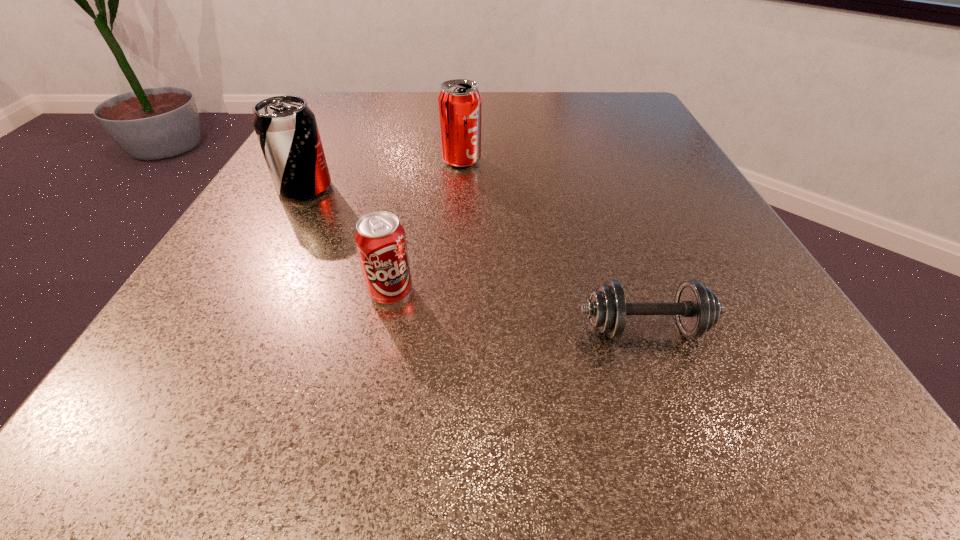
This screenshot has height=540, width=960. In the image, there is a desktop. Identify the location of vacant space at the far right corner. (586, 134).

Locate an element on the screen. empty space between the second farthest object and the rightmost object is located at coordinates (475, 258).

Identify the location of free spot between the third object from left to right and the third nearest object. (383, 174).

The width and height of the screenshot is (960, 540). In order to click on empty space that is in between the leftmost object and the second soda from left to right in this screenshot , I will do `click(348, 240)`.

This screenshot has width=960, height=540. I want to click on free space between the shortest soda and the second nearest soda, so click(x=348, y=240).

You are a GUI agent. You are given a task and a screenshot of the screen. Output one action in this format:
    pyautogui.click(x=<x>, y=<y>)
    Task: Click on the unoccupied position between the leftmost object and the farthest object
    
    Given the screenshot: What is the action you would take?
    pyautogui.click(x=383, y=174)

Where is `free spot between the shortest object and the nearest soda`? The image size is (960, 540). free spot between the shortest object and the nearest soda is located at coordinates (517, 310).

Identify the location of vacant space that is in between the nearest soda and the third nearest object. (348, 240).

This screenshot has height=540, width=960. What are the coordinates of `free spot between the shortest object and the second farthest object` in the screenshot? It's located at (475, 258).

Locate an element on the screen. The height and width of the screenshot is (540, 960). empty location between the third tallest object and the dumbbell is located at coordinates [517, 310].